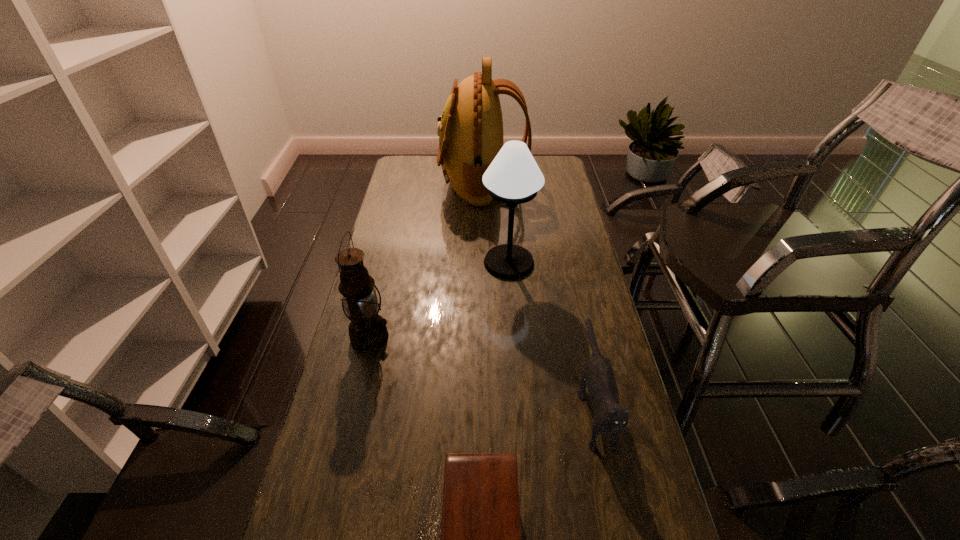
Locate an element on the screen. This screenshot has width=960, height=540. vacant space situated 0.060m on the front-facing side of the backpack is located at coordinates (426, 183).

Image resolution: width=960 pixels, height=540 pixels. I want to click on free location located 0.310m on the front of the second tallest object, so click(x=516, y=350).

At what (x,y) coordinates should I click in order to perform the action: click on vacant region located 0.050m on the back of the third tallest object. Please return your answer as a coordinate pair (x, y). Looking at the image, I should click on (378, 306).

Find the location of a particular element. The height and width of the screenshot is (540, 960). free location located on the front-facing side of the second shortest object is located at coordinates (622, 534).

Where is `object that is positioned at the far edge`? The width and height of the screenshot is (960, 540). object that is positioned at the far edge is located at coordinates (470, 130).

The height and width of the screenshot is (540, 960). I want to click on object present at the left edge, so click(x=367, y=330).

In order to click on object located at the right edge in this screenshot , I will do `click(609, 417)`.

In the image, there is a desktop. Where is `vacant space at the far edge`? vacant space at the far edge is located at coordinates (432, 170).

Locate an element on the screen. The height and width of the screenshot is (540, 960). free space at the left edge is located at coordinates (403, 213).

Find the location of a particular element. vacant space at the right edge of the desktop is located at coordinates (604, 353).